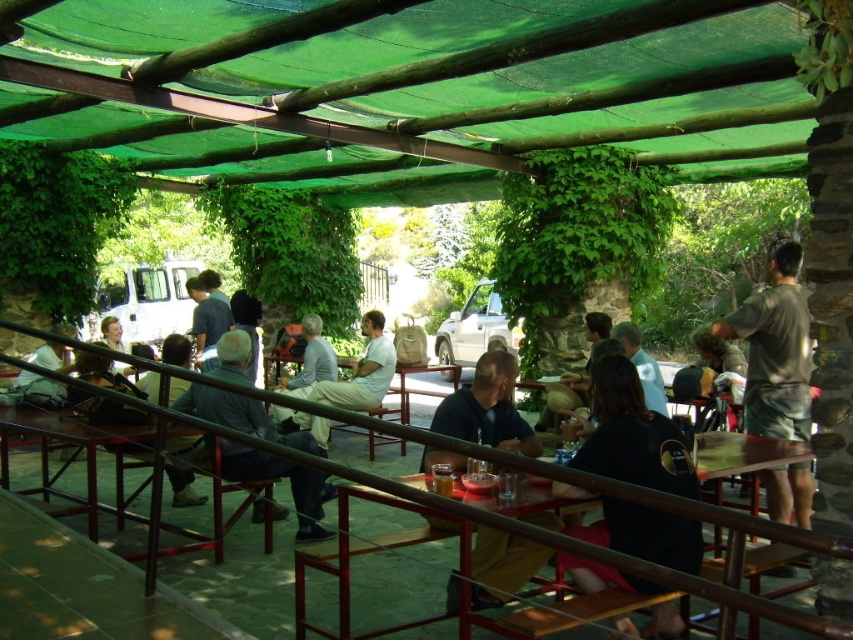
Based on the photo, does wooden table at lower left appear over matte black backpack at left?

Incorrect, wooden table at lower left is not positioned above matte black backpack at left.

Can you confirm if wooden table at lower left is smaller than matte black backpack at left?

Incorrect, wooden table at lower left is not smaller in size than matte black backpack at left.

Between point (120, 438) and point (35, 384), which one is positioned behind?

The point (35, 384) is behind.

Locate an element on the screen. This screenshot has height=640, width=853. wooden table at lower left is located at coordinates (64, 444).

Where is `black fabric shirt at center`? The height and width of the screenshot is (640, 853). black fabric shirt at center is located at coordinates click(x=631, y=435).

Can you confirm if black fabric shirt at center is positioned above matte brown bag at center?

No, black fabric shirt at center is not above matte brown bag at center.

Locate an element on the screen. black fabric shirt at center is located at coordinates (631, 435).

At what (x,y) coordinates should I click in order to perform the action: click on black fabric shirt at center. Please return your answer as a coordinate pair (x, y). The width and height of the screenshot is (853, 640). Looking at the image, I should click on (631, 435).

You are a GUI agent. You are given a task and a screenshot of the screen. Output one action in this format:
    pyautogui.click(x=<x>, y=<y>)
    Task: Click on the light blue shirt at center
    This screenshot has height=640, width=853.
    Given the screenshot: What is the action you would take?
    coord(358,372)

Is point (334, 392) less distant than point (6, 401)?

No, it is behind (6, 401).

You are a GUI agent. You are given a task and a screenshot of the screen. Output one action in this format:
    pyautogui.click(x=<x>, y=<y>)
    Task: Click on the light blue shirt at center
    This screenshot has width=853, height=640.
    Given the screenshot: What is the action you would take?
    pyautogui.click(x=358, y=372)